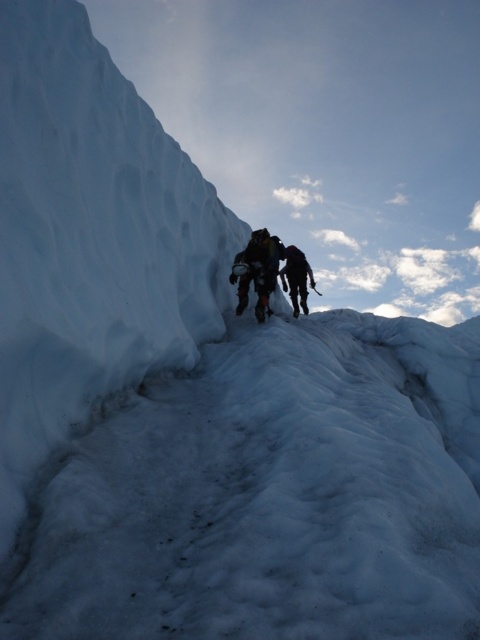
Can you confirm if black fabric backpack at center is positioned to the right of dark gray fabric jacket at center?

Incorrect, black fabric backpack at center is not on the right side of dark gray fabric jacket at center.

Is black fabric backpack at center below dark gray fabric jacket at center?

No, black fabric backpack at center is not below dark gray fabric jacket at center.

Where is `black fabric backpack at center`? This screenshot has height=640, width=480. black fabric backpack at center is located at coordinates (265, 269).